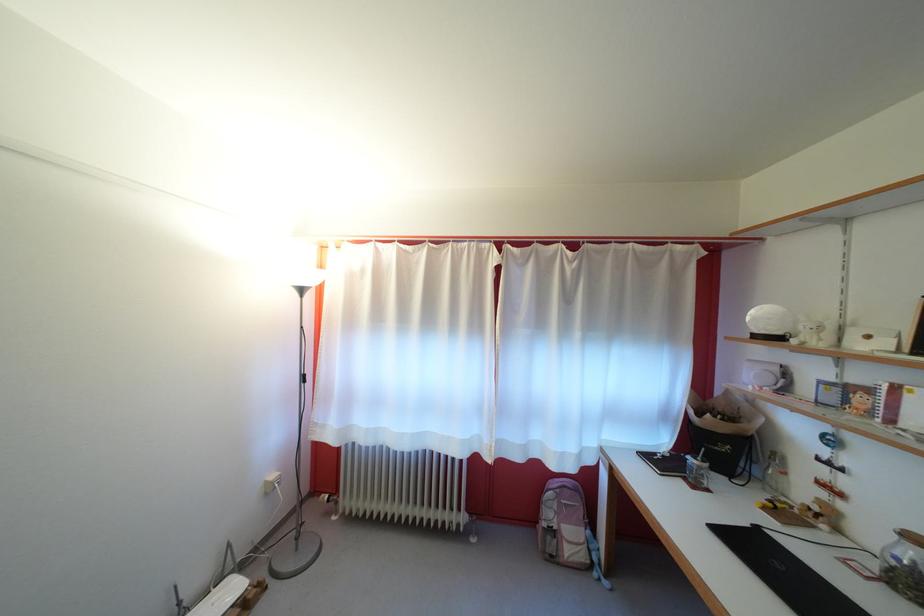
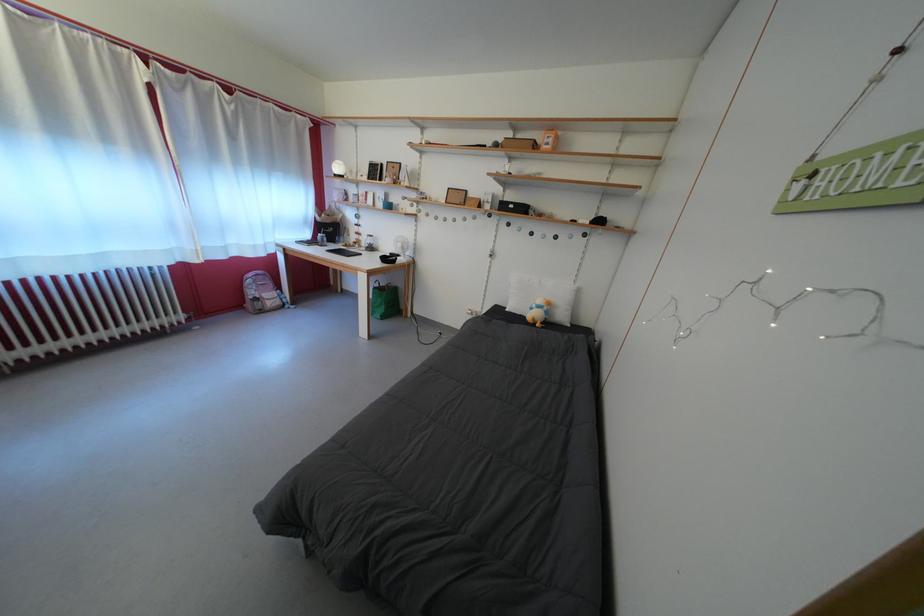
Locate, in the second image, the point that corresponds to the point at 556,521 in the first image.

(261, 299)